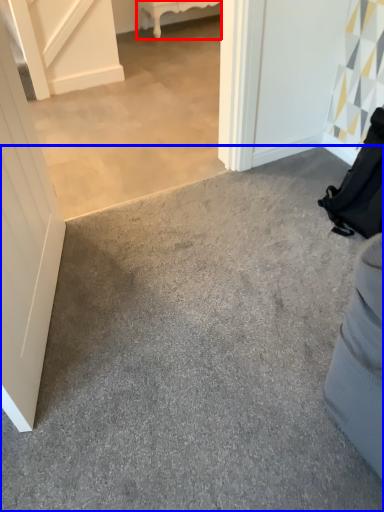
Question: Which object appears farthest to the camera in this image, furniture (highlighted by a red box) or concrete (highlighted by a blue box)?

Choices:
 (A) furniture
 (B) concrete

Answer: (A)